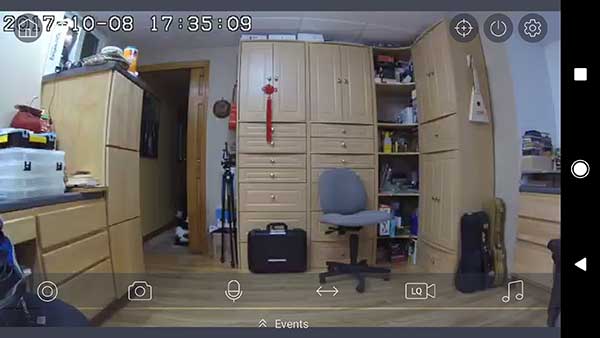
What are the coordinates of `cabinet doors` in the screenshot? It's located at (336, 85), (255, 71), (441, 87), (443, 197).